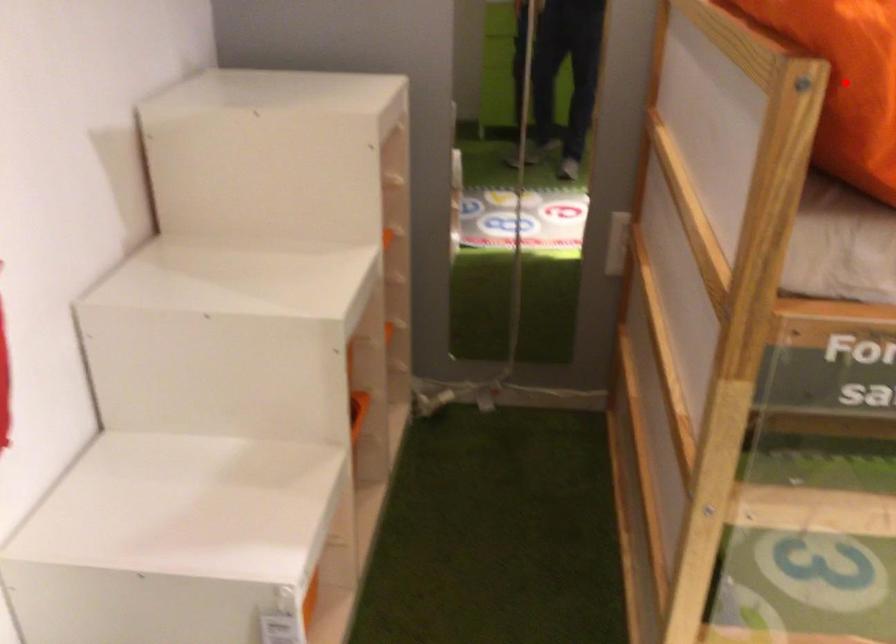
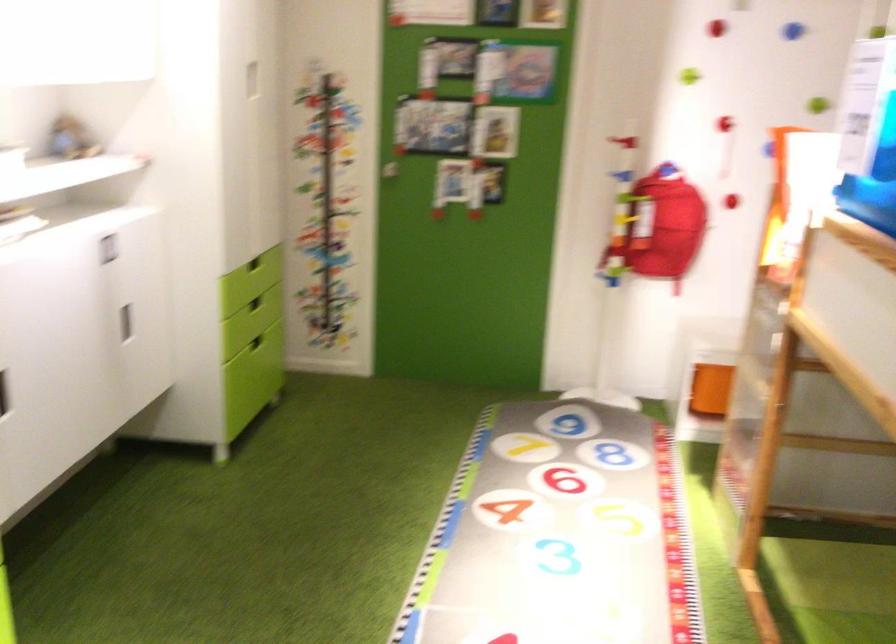
Question: I am providing you with two images of the same scene from different viewpoints. A red point is marked on the first image. Can you still see the location of the red point in image 2?

Choices:
 (A) Yes
 (B) No

Answer: (B)